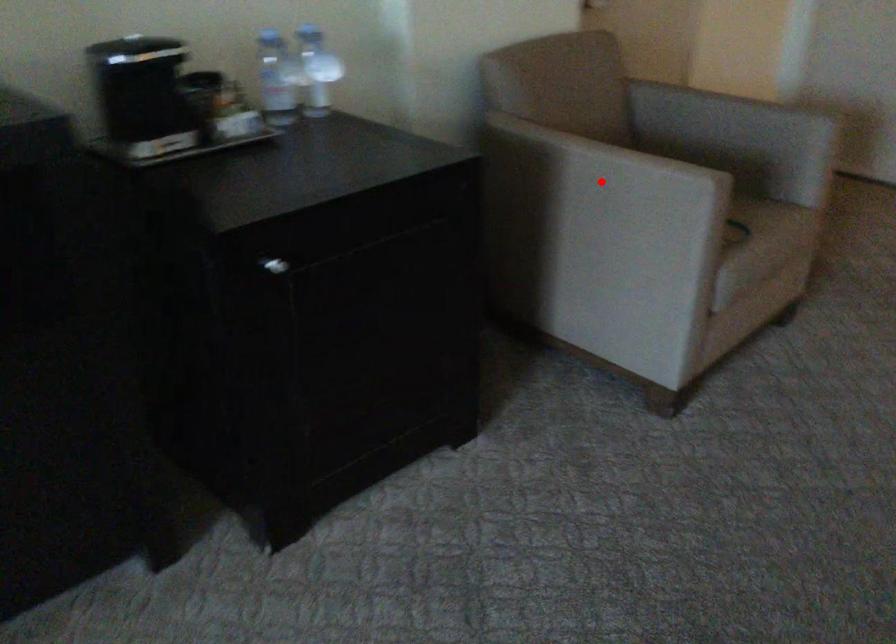
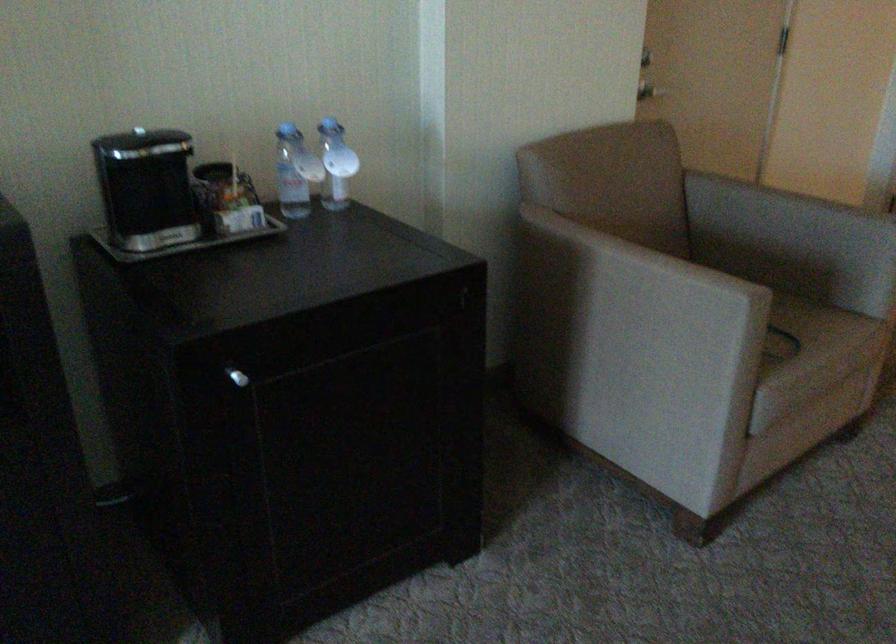
Question: I am providing you with two images of the same scene from different viewpoints. A red point is marked on the first image. Is the red point's position out of view in image 2?

Choices:
 (A) Yes
 (B) No

Answer: (B)